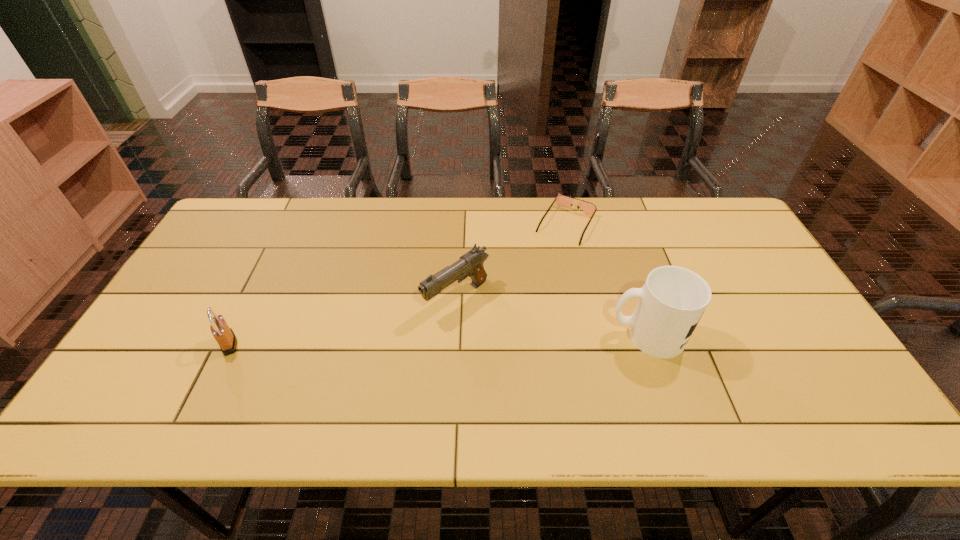
Identify the location of vacant space on the desktop that is between the padlock and the mug and is positioned on the bridge of the sunglasses. (497, 339).

Image resolution: width=960 pixels, height=540 pixels. I want to click on vacant space on the desktop that is between the leftmost object and the tallest object and is positioned in the direction the third object from right to left is aimed, so click(x=396, y=340).